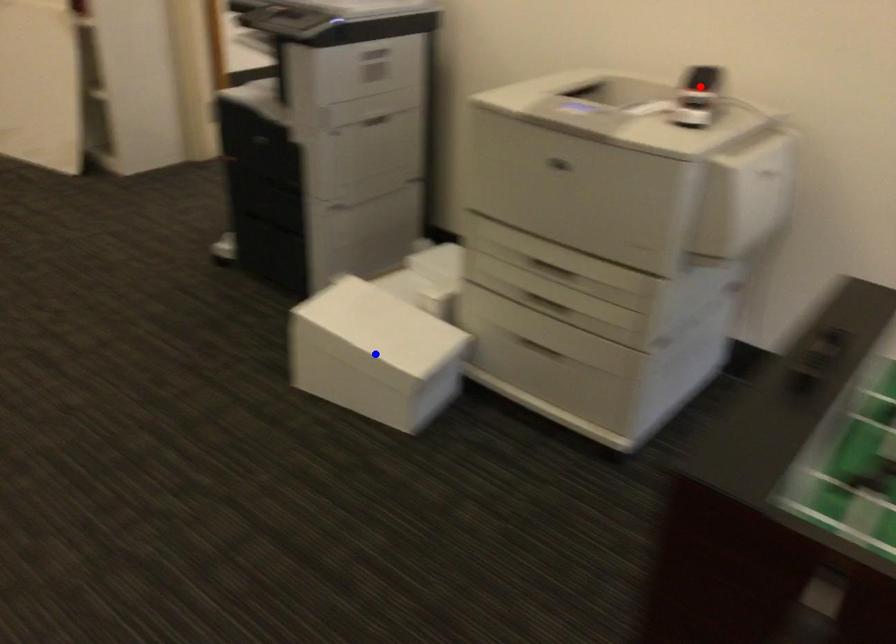
Question: Two points are marked on the image. Which point is closer to the camera?

Choices:
 (A) Blue point is closer.
 (B) Red point is closer.

Answer: (B)